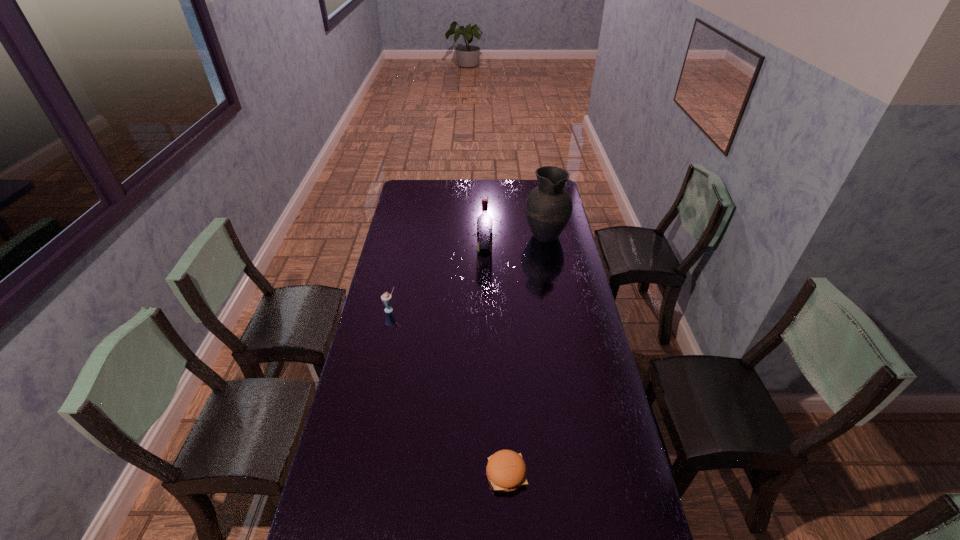
Identify the location of free space located 0.080m on the front and back of the second tallest object. (460, 253).

The width and height of the screenshot is (960, 540). I want to click on vacant region located 0.290m on the front and back of the second tallest object, so click(x=414, y=253).

The height and width of the screenshot is (540, 960). I want to click on vacant region located on the front and back of the second tallest object, so click(444, 253).

The width and height of the screenshot is (960, 540). I want to click on vacant space located on the straw side of the leftmost object, so click(x=377, y=372).

Locate an element on the screen. The width and height of the screenshot is (960, 540). vacant space situated on the right of the shortest object is located at coordinates (551, 474).

Image resolution: width=960 pixels, height=540 pixels. Find the location of `object located in the left edge section of the desktop`. object located in the left edge section of the desktop is located at coordinates (386, 298).

This screenshot has width=960, height=540. Find the location of `object situated at the right edge`. object situated at the right edge is located at coordinates (x=548, y=207).

In order to click on free space at the far edge of the desktop in this screenshot , I will do `click(459, 193)`.

In the image, there is a desktop. At what (x,y) coordinates should I click in order to perform the action: click on vacant space at the left edge. Please return your answer as a coordinate pair (x, y). Looking at the image, I should click on (373, 362).

Locate an element on the screen. free region at the right edge of the desktop is located at coordinates (588, 411).